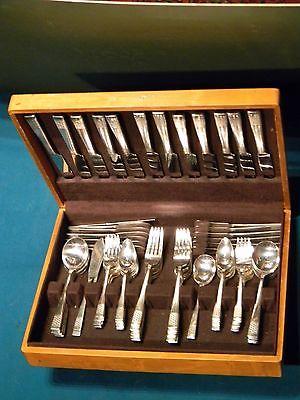
Where is `forks`? This screenshot has width=300, height=400. forks is located at coordinates (100, 312), (136, 320), (175, 305), (238, 302).